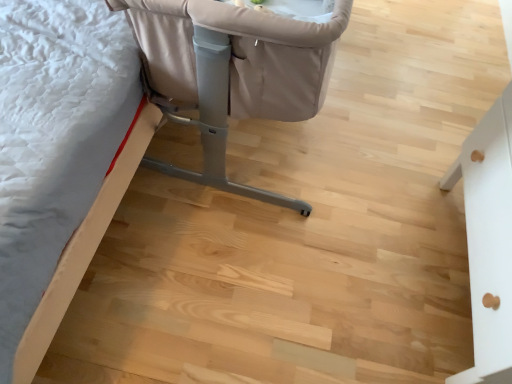
You are a GUI agent. You are given a task and a screenshot of the screen. Output one action in this format:
    pyautogui.click(x=<x>, y=<y>)
    Task: Click on the free point in front of beige fabric crib at upper center, the second furniture from the right
    This screenshot has width=512, height=384.
    Given the screenshot: What is the action you would take?
    pyautogui.click(x=247, y=275)